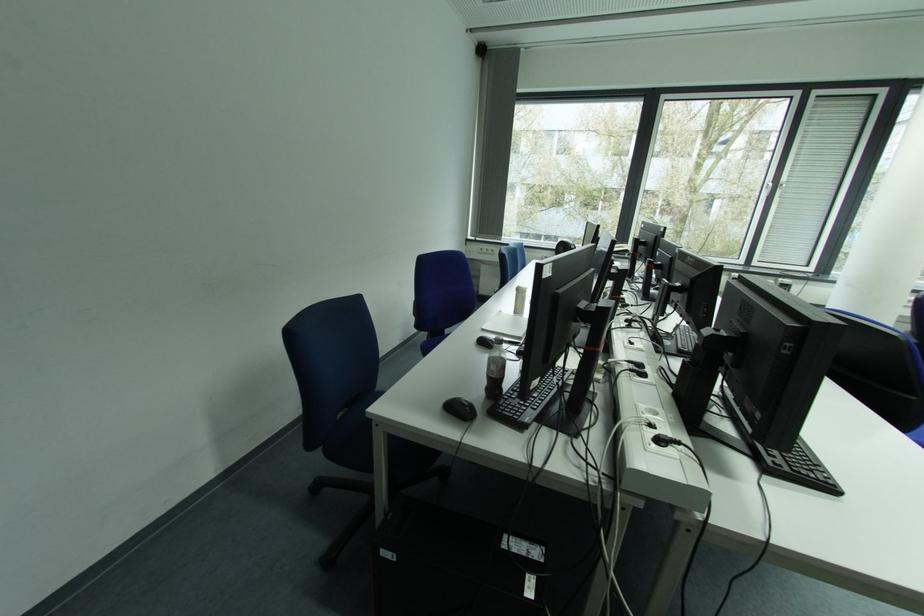
Locate an element on the screen. blue chair sitting surface is located at coordinates (359, 439).